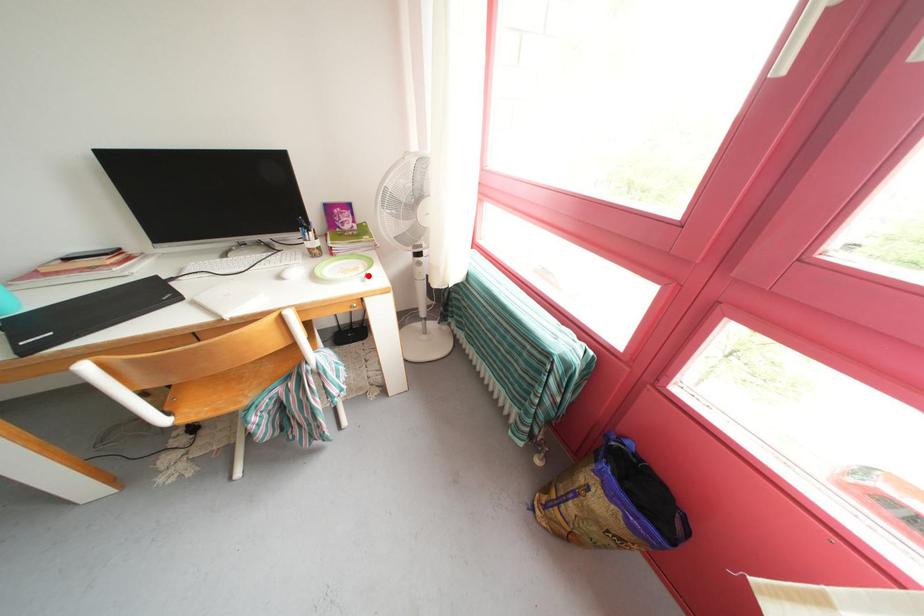
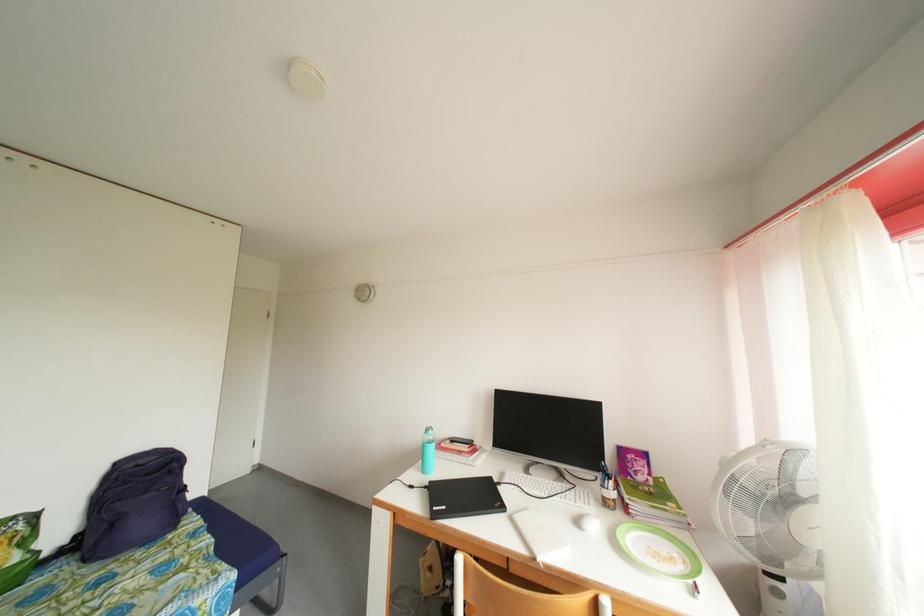
Where in the second image is the point corresponding to the highlighted location from the first image?

(688, 573)